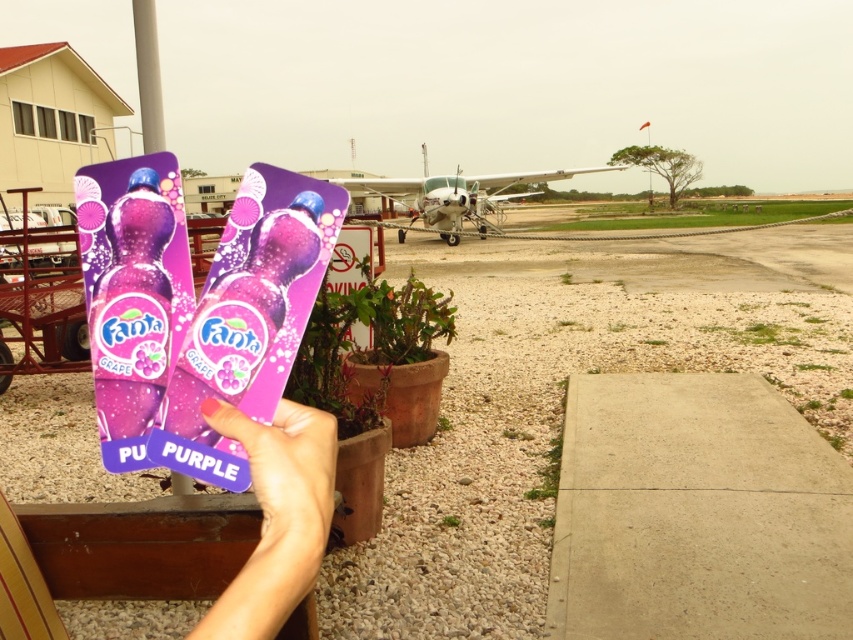
Question: Which point is closer to the camera?

Choices:
 (A) (258, 554)
 (B) (624, 164)

Answer: (A)

Question: Can you confirm if purple matte card at lower left is smaller than metallic silver airplane at center?

Choices:
 (A) yes
 (B) no

Answer: (A)

Question: Which point is closer to the camera?

Choices:
 (A) metallic silver airplane at center
 (B) purple matte card at lower left

Answer: (B)

Question: Which object appears closest to the camera in this image?

Choices:
 (A) metallic silver airplane at center
 (B) purple matte card at lower left

Answer: (B)

Question: Considering the relative positions of purple matte card at lower left and metallic silver airplane at center in the image provided, where is purple matte card at lower left located with respect to metallic silver airplane at center?

Choices:
 (A) left
 (B) right

Answer: (A)

Question: Is purple matte card at lower left closer to camera compared to metallic silver airplane at center?

Choices:
 (A) yes
 (B) no

Answer: (A)